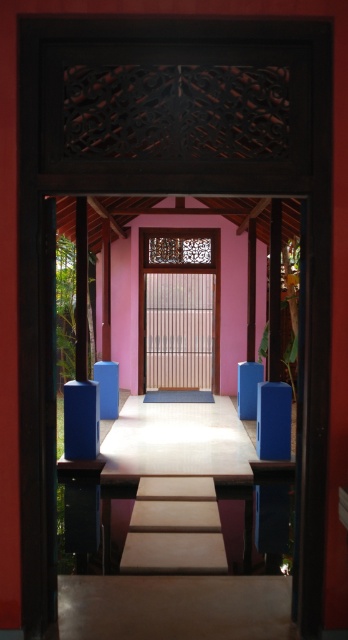
You are an interior designer planning to install a new decorative panel that must fit within the space between the wooden screen door at center and the blue matte pillar at right. The panel is 1.2 meters wide. Can you confirm if the space between them is wide enough to accommodate the panel?

The wooden screen door at center is wider than the blue matte pillar at right. However, the exact distance between them isn not specified in the provided description. Without knowing the actual spacing, it is impossible to determine if the 1.2 meter panel will fit. Additional measurements are needed.

You are standing outside the doorway and want to enter the building. The wooden screen door at center is slightly open. To your right, there is a blue matte pillar at right. Which object is closer to you as you face the doorway?

The wooden screen door at center is closer to you because the blue matte pillar at right is behind it.